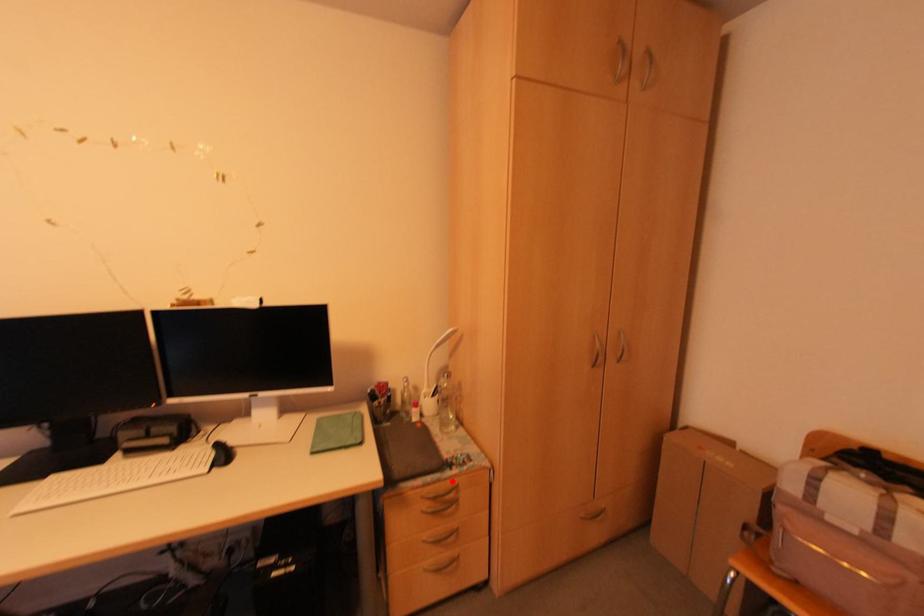
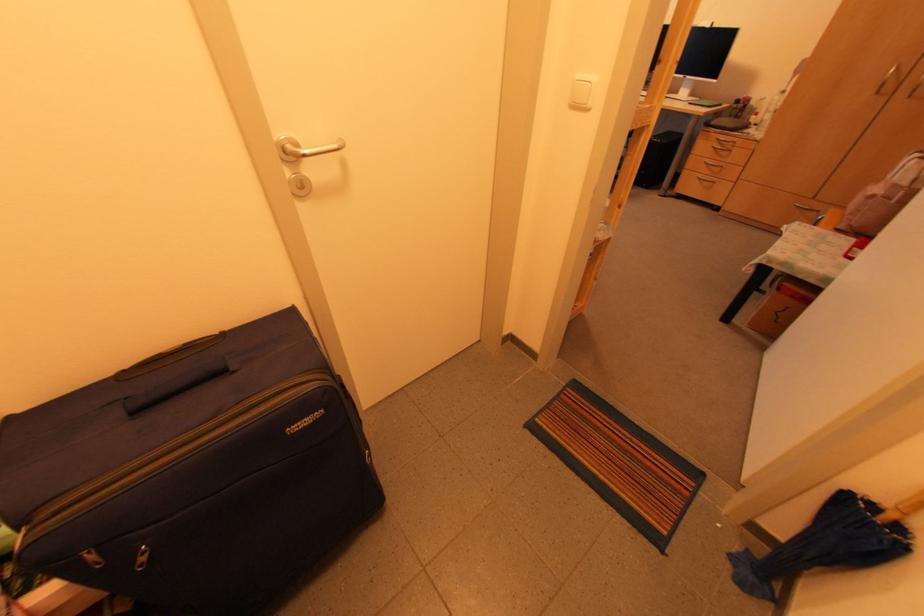
Find the pixel in the second image that matches the highlighted location in the first image.

(734, 140)